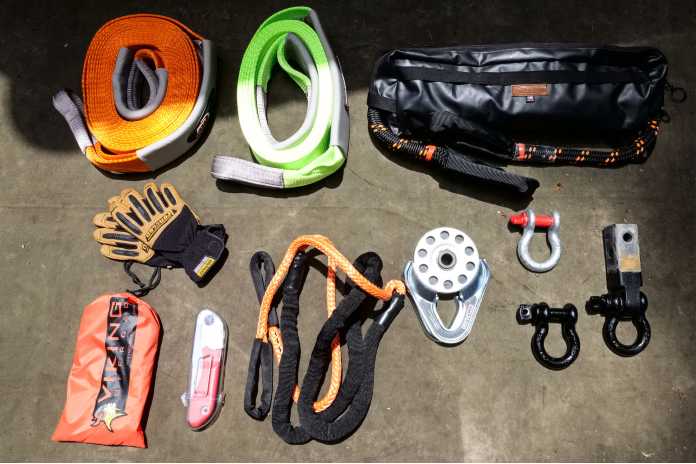
The height and width of the screenshot is (464, 696). Identify the location of grey cover. (171, 144).